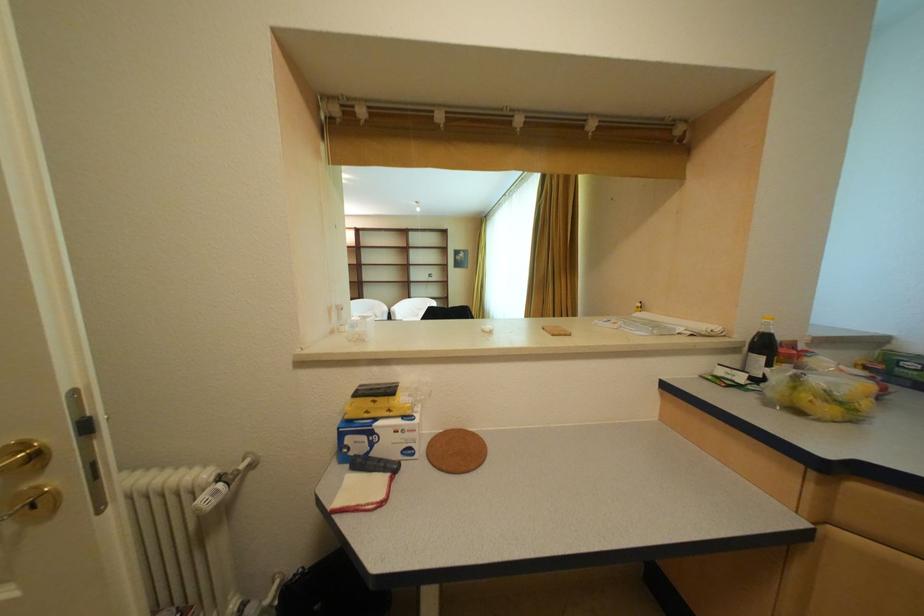
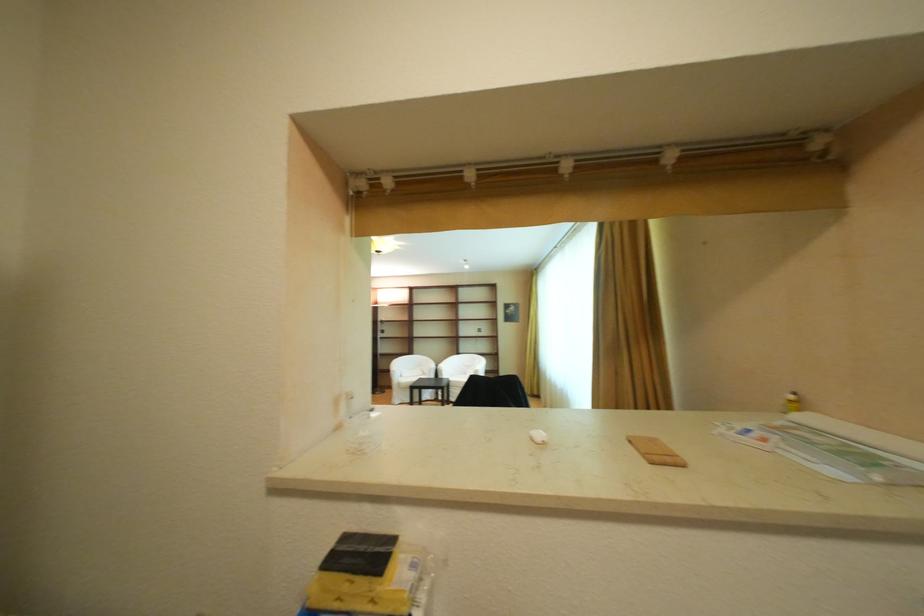
In the second image, find the point that corresponds to point (388, 302) in the first image.

(436, 359)